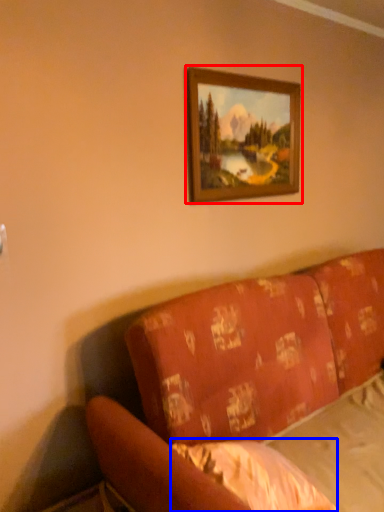
Question: Which of the following is the farthest to the observer, picture frame (highlighted by a red box) or sheet (highlighted by a blue box)?

Choices:
 (A) picture frame
 (B) sheet

Answer: (A)